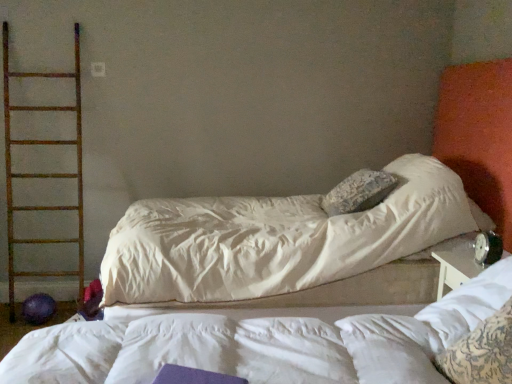
Question: Does black plastic alarm clock at right have a larger size compared to white textured pillow at right?

Choices:
 (A) no
 (B) yes

Answer: (A)

Question: Considering the relative positions of black plastic alarm clock at right and white textured pillow at right in the image provided, is black plastic alarm clock at right to the left of white textured pillow at right from the viewer's perspective?

Choices:
 (A) yes
 (B) no

Answer: (B)

Question: Does black plastic alarm clock at right have a smaller size compared to white textured pillow at right?

Choices:
 (A) yes
 (B) no

Answer: (A)

Question: Is black plastic alarm clock at right looking in the opposite direction of white textured pillow at right?

Choices:
 (A) yes
 (B) no

Answer: (B)

Question: Is the position of black plastic alarm clock at right more distant than that of white textured pillow at right?

Choices:
 (A) yes
 (B) no

Answer: (A)

Question: From the image's perspective, relative to rusty metal ladder at left, is white textured pillow at right above or below?

Choices:
 (A) above
 (B) below

Answer: (B)

Question: Is white textured pillow at right spatially inside rusty metal ladder at left, or outside of it?

Choices:
 (A) outside
 (B) inside

Answer: (A)

Question: In terms of height, does white textured pillow at right look taller or shorter compared to rusty metal ladder at left?

Choices:
 (A) tall
 (B) short

Answer: (B)

Question: Relative to rusty metal ladder at left, is white textured pillow at right in front or behind?

Choices:
 (A) behind
 (B) front

Answer: (B)

Question: Does point (480, 235) appear closer or farther from the camera than point (430, 311)?

Choices:
 (A) closer
 (B) farther

Answer: (B)

Question: Is black plastic alarm clock at right inside the boundaries of white textured pillow at right, or outside?

Choices:
 (A) outside
 (B) inside

Answer: (A)

Question: From a real-world perspective, relative to white textured pillow at right, is black plastic alarm clock at right vertically above or below?

Choices:
 (A) above
 (B) below

Answer: (A)

Question: Is black plastic alarm clock at right taller or shorter than white textured pillow at right?

Choices:
 (A) tall
 (B) short

Answer: (B)

Question: Is point (504, 273) positioned closer to the camera than point (482, 261)?

Choices:
 (A) farther
 (B) closer

Answer: (B)

Question: Looking at the image, does white textured pillow at right seem bigger or smaller compared to black plastic alarm clock at right?

Choices:
 (A) small
 (B) big

Answer: (B)